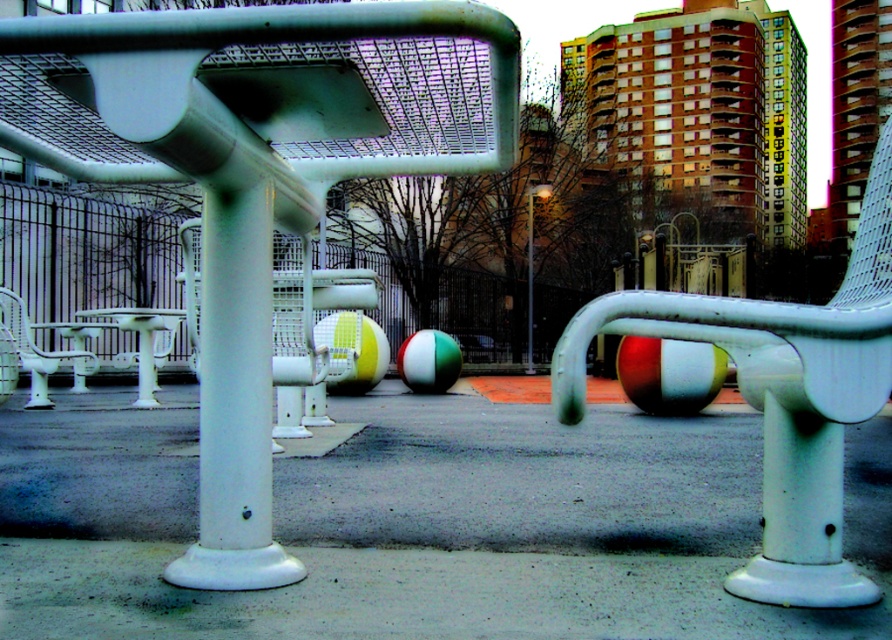
Can you confirm if white plastic chair at center is wider than yellow-green striped beach ball at center?

Yes, white plastic chair at center is wider than yellow-green striped beach ball at center.

Describe the element at coordinates (780, 396) in the screenshot. The image size is (892, 640). I see `white plastic chair at center` at that location.

Locate an element on the screen. This screenshot has height=640, width=892. white plastic chair at center is located at coordinates (780, 396).

Between white plastic chair at left and green and white rubber ball at center, which one has less height?

green and white rubber ball at center is shorter.

Who is positioned more to the right, white plastic chair at left or green and white rubber ball at center?

green and white rubber ball at center is more to the right.

Is point (42, 404) closer to viewer compared to point (457, 358)?

Yes.

Locate an element on the screen. The image size is (892, 640). white plastic chair at left is located at coordinates (35, 349).

Who is more distant from viewer, [34,372] or [530,195]?

The point [530,195] is more distant.

Is point (87, 368) farther from viewer compared to point (530, 316)?

No, it is in front of (530, 316).

Locate an element on the screen. Image resolution: width=892 pixels, height=640 pixels. white plastic chair at left is located at coordinates click(35, 349).